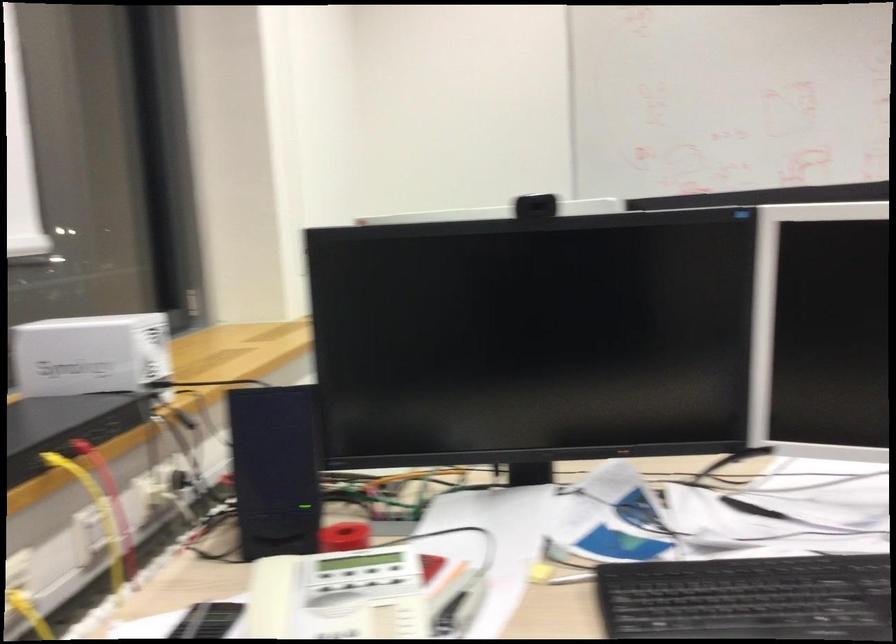
Identify the location of black computer speaker. This screenshot has height=644, width=896. (274, 469).